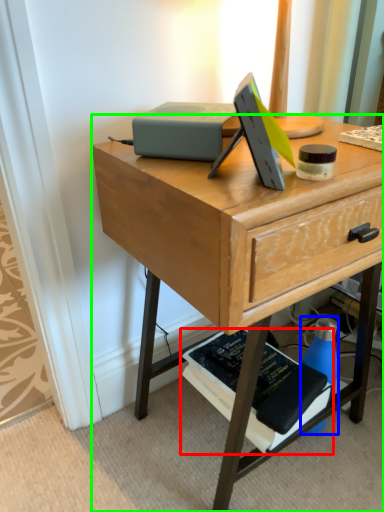
Question: Which object is the closest to the paperback book (highlighted by a red box)? Choose among these: bottle (highlighted by a blue box) or desk (highlighted by a green box).

Choices:
 (A) bottle
 (B) desk

Answer: (A)